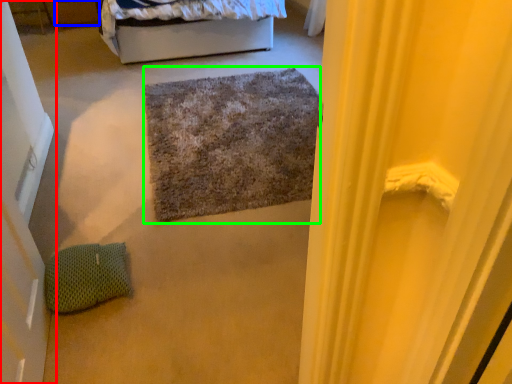
Question: Which object is positioned farthest from door (highlighted by a red box)? Select from drawer (highlighted by a blue box) and doormat (highlighted by a green box).

Choices:
 (A) drawer
 (B) doormat

Answer: (A)